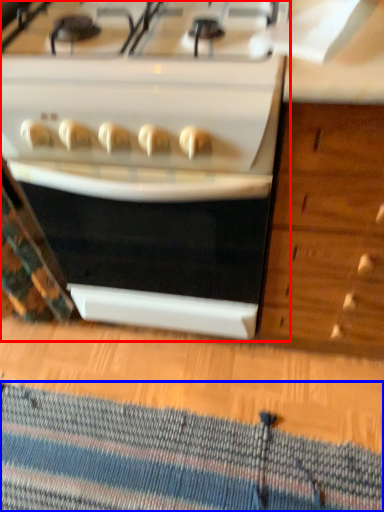
Question: Which object is closer to the camera taking this photo, kitchen appliance (highlighted by a red box) or doormat (highlighted by a blue box)?

Choices:
 (A) kitchen appliance
 (B) doormat

Answer: (A)